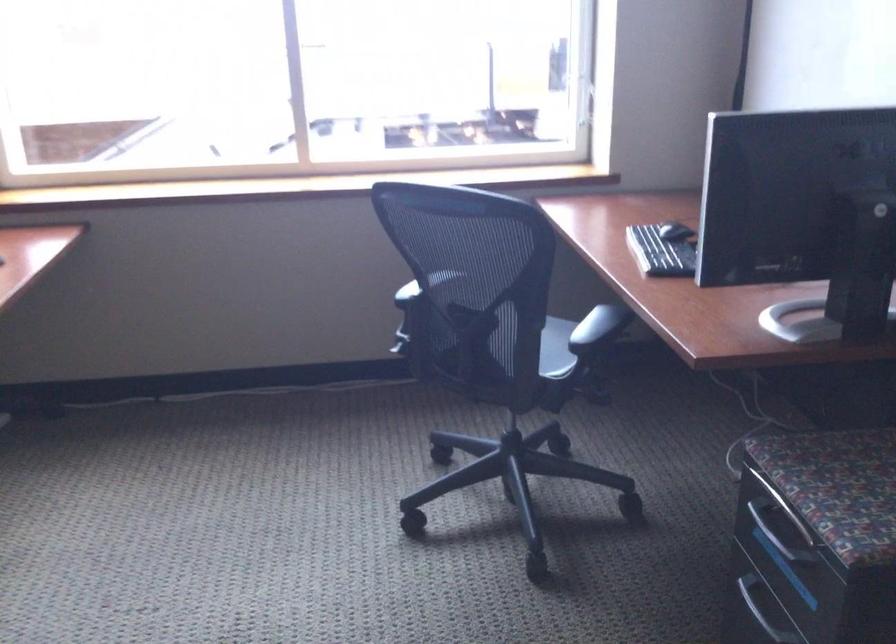
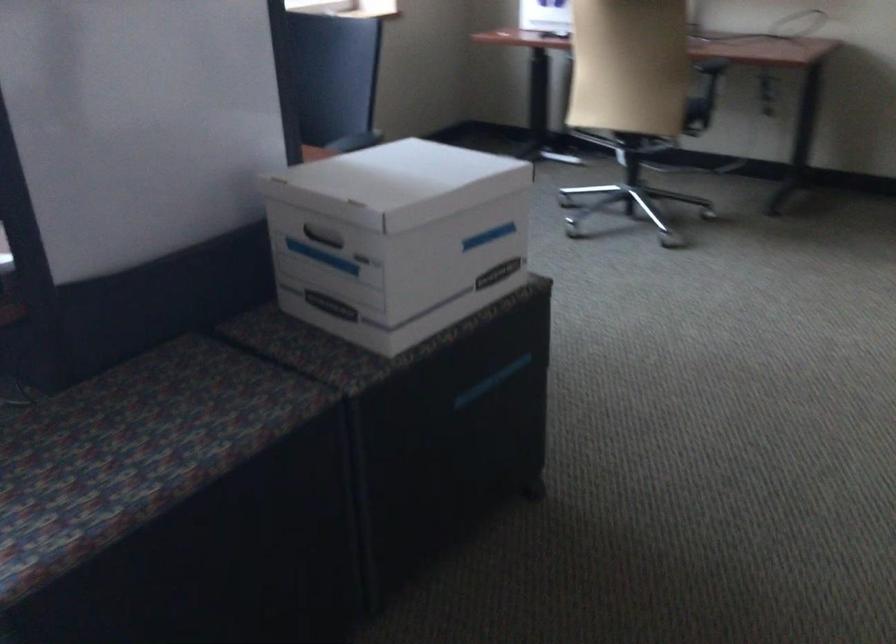
Question: The images are taken continuously from a first-person perspective. In which direction is your viewpoint rotating?

Choices:
 (A) Left
 (B) Right
 (C) Up
 (D) Down

Answer: (B)